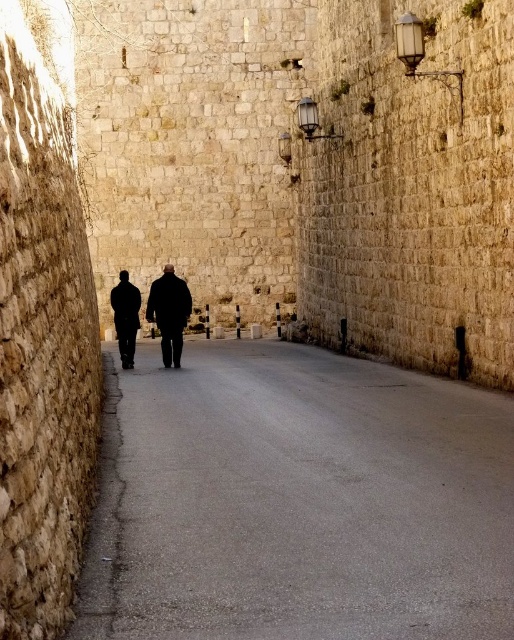
Question: Which object appears farthest from the camera in this image?

Choices:
 (A) gray asphalt road at center
 (B) dark matte coat at center

Answer: (B)

Question: Which point is closer to the camera taking this photo?

Choices:
 (A) (303, 596)
 (B) (149, 292)
 (C) (128, 355)

Answer: (A)

Question: Can you confirm if black matte clothing at center is smaller than dark matte coat at center?

Choices:
 (A) no
 (B) yes

Answer: (A)

Question: Does gray asphalt road at center have a larger size compared to black matte clothing at center?

Choices:
 (A) no
 (B) yes

Answer: (A)

Question: Does gray asphalt road at center appear on the right side of black matte clothing at center?

Choices:
 (A) no
 (B) yes

Answer: (B)

Question: Among these points, which one is farthest from the camera?

Choices:
 (A) (181, 307)
 (B) (473, 458)
 (C) (113, 298)

Answer: (C)